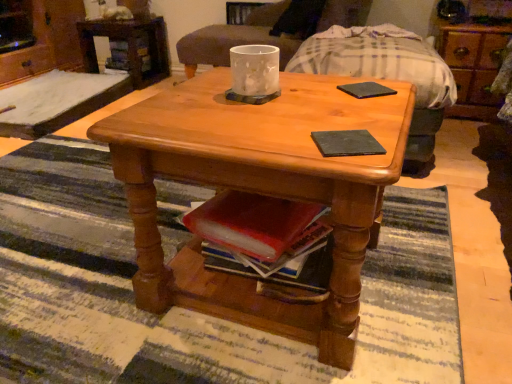
Locate an element on the screen. The width and height of the screenshot is (512, 384). vacant space situated on the left part of black matte pad at center, the second pad from the right is located at coordinates (264, 137).